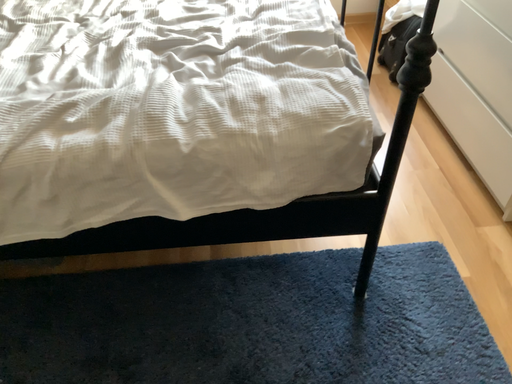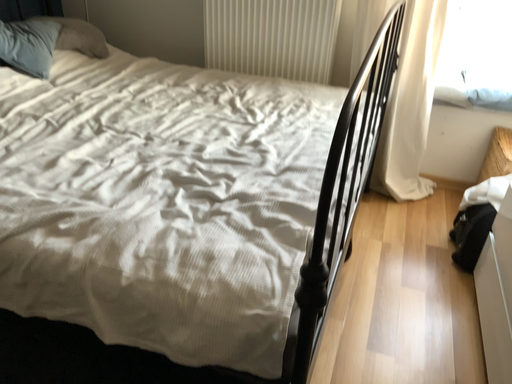
Question: How did the camera likely rotate when shooting the video?

Choices:
 (A) rotated downward
 (B) rotated upward

Answer: (B)